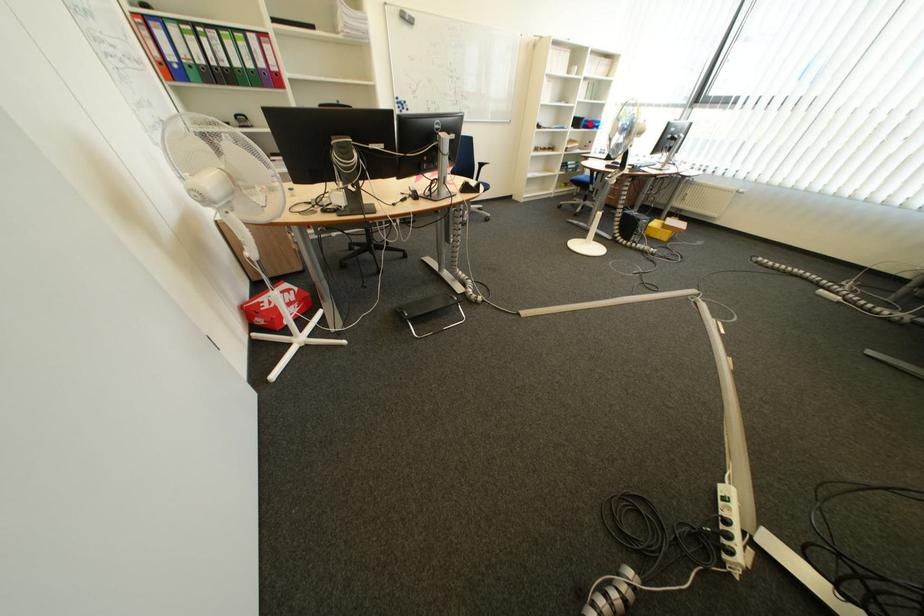
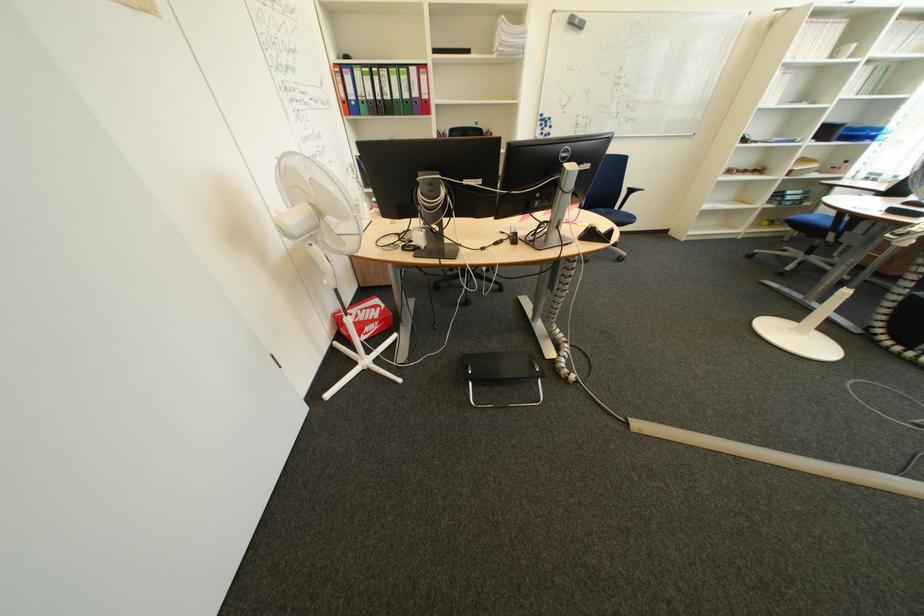
In the second image, find the point that corresponds to the highlighted location in the first image.

(840, 132)